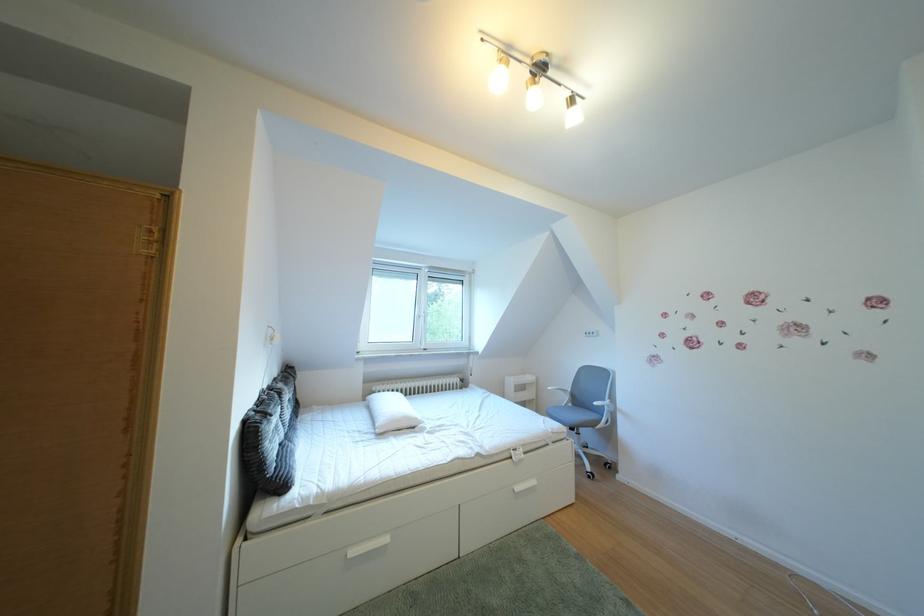
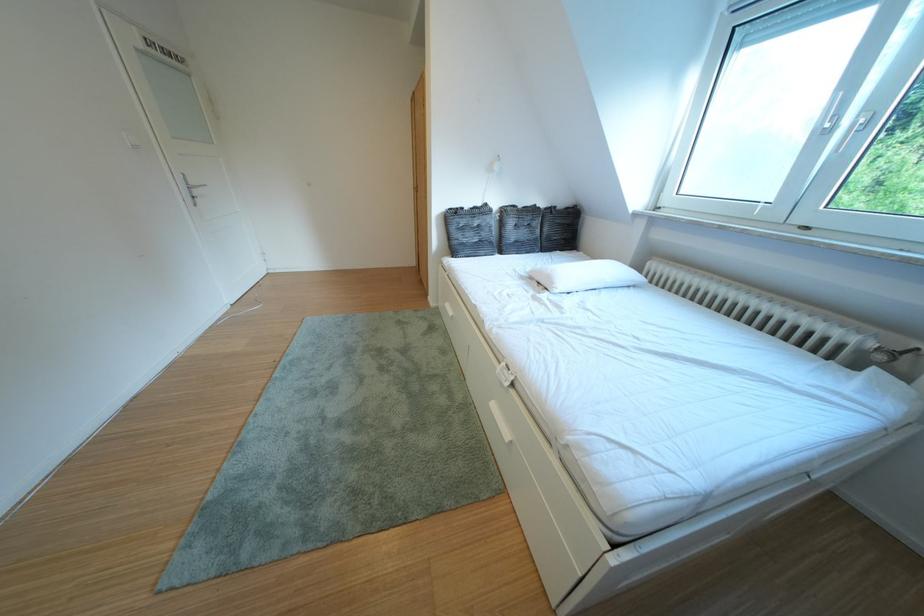
The point at (367, 559) is marked in the first image. Where is the corresponding point in the second image?

(460, 310)